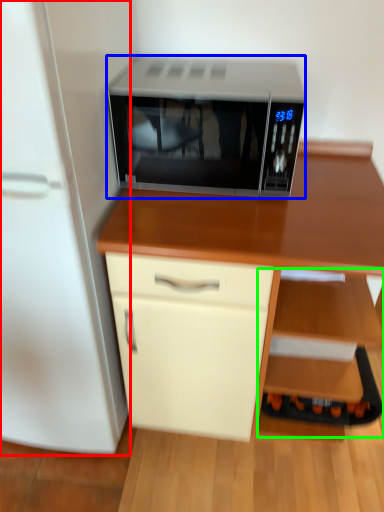
Question: Which object is positioned farthest from refrigerator (highlighted by a red box)? Select from microwave oven (highlighted by a blue box) and shelf (highlighted by a green box).

Choices:
 (A) microwave oven
 (B) shelf

Answer: (B)